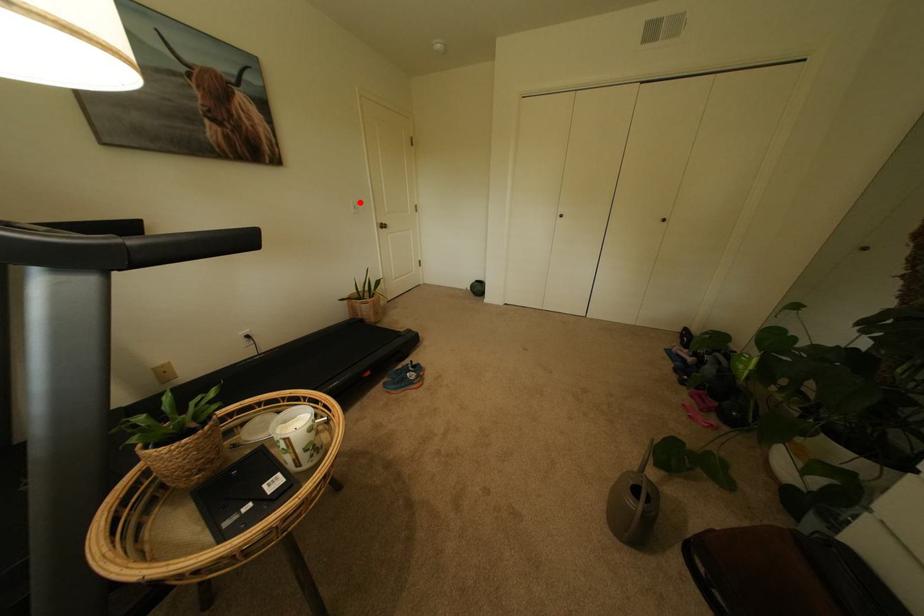
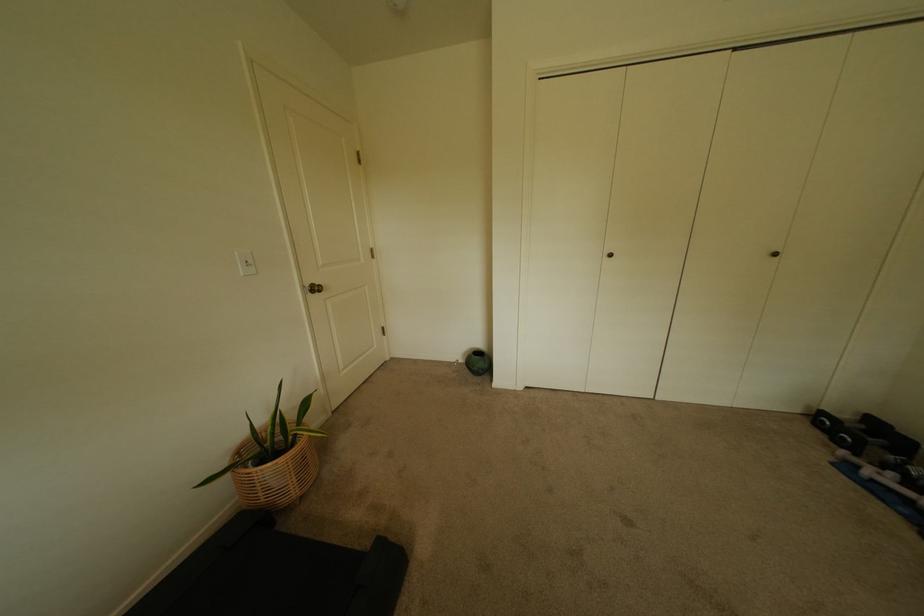
Question: I am providing you with two images of the same scene from different viewpoints. A red point is marked on the first image. At the location where the point appears in image 1, is it still visible in image 2?

Choices:
 (A) Yes
 (B) No

Answer: (A)